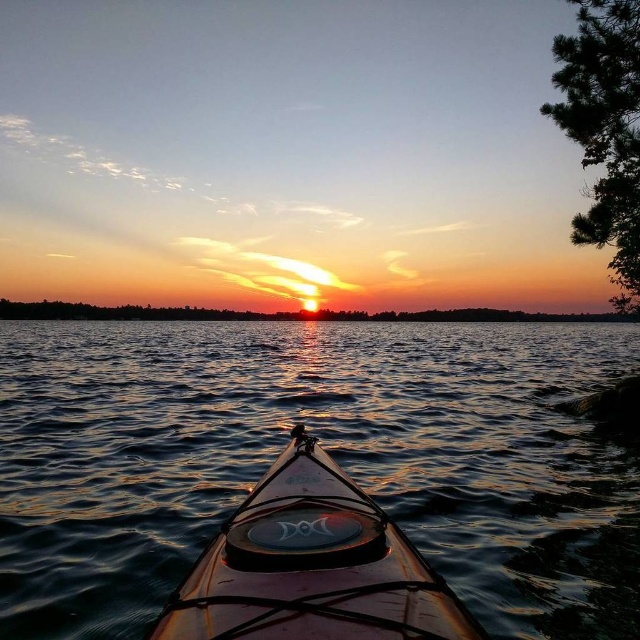
You are in a kayak and want to take a photo of the smooth orange sky at center. However, the translucent brown canoe at center is blocking your view. Can you confirm if the canoe is between you and the sky?

The translucent brown canoe at center is in front of the smooth orange sky at center, so yes, the canoe is blocking your view of the sky.

You are in a kayak and want to reach a floating dock ahead. You notice the translucent brown canoe at center and the glossy water at center. Which object is closer to you as you paddle forward?

The glossy water at center is closer to you because the translucent brown canoe at center is behind it.

You are in a kayak and want to take a photo of the glossy water at center and the smooth orange sky at center. Which one is closer to your camera lens?

The glossy water at center is closer to the viewer than the smooth orange sky at center, so the glossy water at center would be closer to your camera lens.